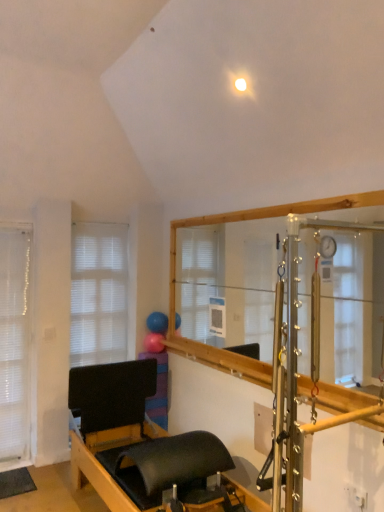
Question: From a real-world perspective, is blue rubber balloon at center, placed as the second balloon when sorted from bottom to top, physically located above or below black matte bed frame at lower center?

Choices:
 (A) above
 (B) below

Answer: (A)

Question: In the image, is blue rubber balloon at center, which ranks as the first balloon in top-to-bottom order, on the left side or the right side of black matte bed frame at lower center?

Choices:
 (A) left
 (B) right

Answer: (B)

Question: Which object is the farthest from the white sheer curtain at left?

Choices:
 (A) white matte window at left
 (B) rubber ball at upper center, acting as the 2th balloon starting from the top
 (C) black matte bed frame at lower center
 (D) blue rubber balloon at center, placed as the second balloon when sorted from bottom to top

Answer: (C)

Question: Based on their relative distances, which object is nearer to the black matte bed frame at lower center?

Choices:
 (A) rubber ball at upper center, the first balloon when ordered from bottom to top
 (B) white sheer curtain at left
 (C) blue rubber balloon at center, which ranks as the first balloon in top-to-bottom order
 (D) white matte window at left

Answer: (A)